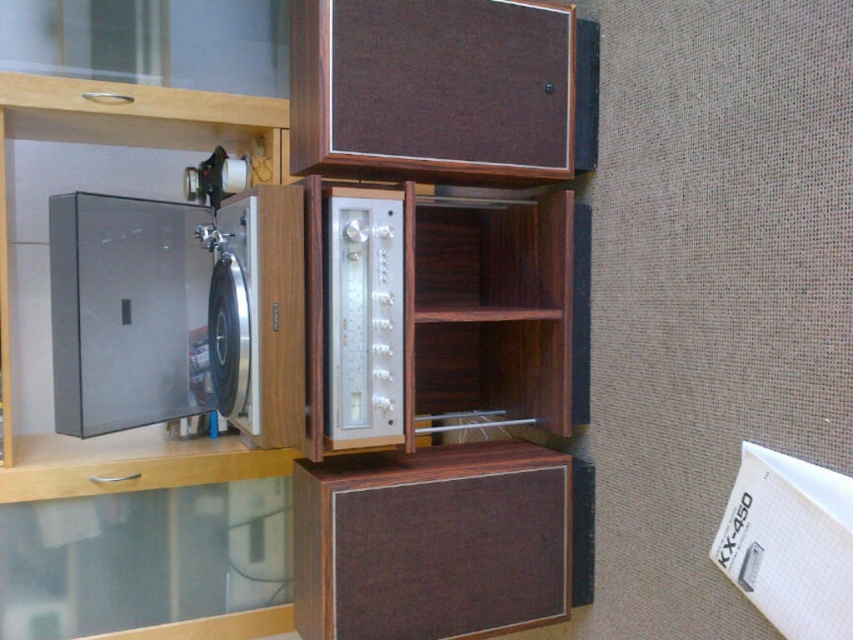
Question: Considering the relative positions of wooden cabinet at upper center and silver metallic turntable at center in the image provided, where is wooden cabinet at upper center located with respect to silver metallic turntable at center?

Choices:
 (A) below
 (B) above

Answer: (A)

Question: Which of the following is the farthest from the observer?

Choices:
 (A) wooden cabinet at upper center
 (B) brown wood speaker at upper center
 (C) brown wood speaker at lower center

Answer: (A)

Question: Which is nearer to the brown wood speaker at upper center?

Choices:
 (A) silver metallic turntable at center
 (B) brown wood speaker at lower center

Answer: (A)

Question: Can you confirm if brown wood speaker at upper center is positioned to the left of silver metallic turntable at center?

Choices:
 (A) no
 (B) yes

Answer: (A)

Question: Is brown wood speaker at lower center positioned at the back of silver metallic turntable at center?

Choices:
 (A) no
 (B) yes

Answer: (B)

Question: Which object appears closest to the camera in this image?

Choices:
 (A) silver metallic turntable at center
 (B) silver metallic amplifier at center

Answer: (A)